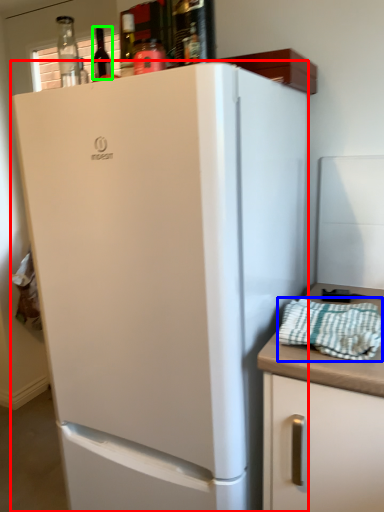
Question: Estimate the real-world distances between objects in this image. Which object is farther from refrigerator (highlighted by a red box), blanket (highlighted by a blue box) or wine bottle (highlighted by a green box)?

Choices:
 (A) blanket
 (B) wine bottle

Answer: (B)